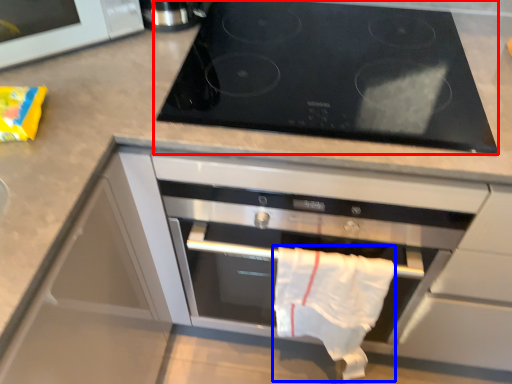
Question: Which object is closer to the camera taking this photo, gas stove (highlighted by a red box) or cloth (highlighted by a blue box)?

Choices:
 (A) gas stove
 (B) cloth

Answer: (A)